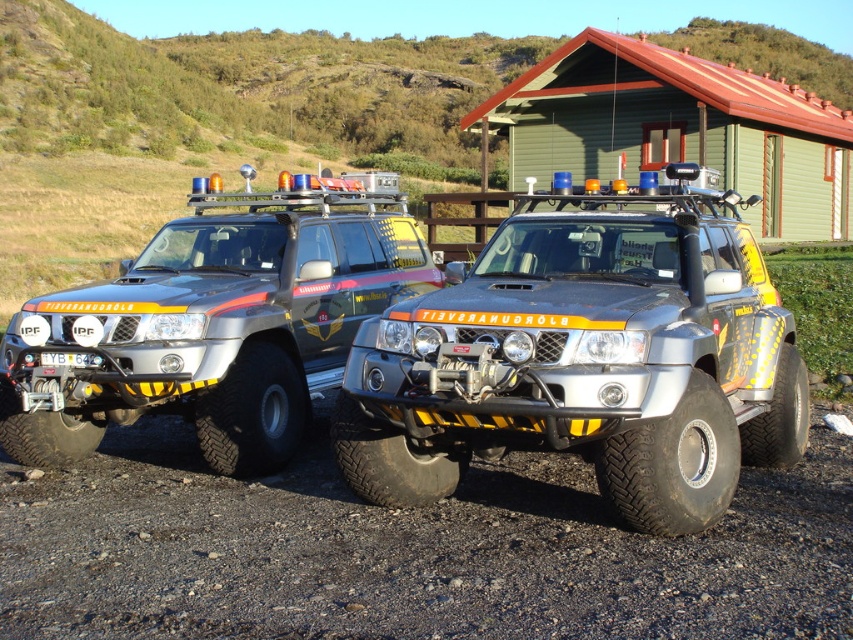
Who is more forward, (x=387, y=577) or (x=99, y=292)?

Point (x=387, y=577)

Who is shorter, dirt track at lower left or silver metallic suv at center?

With less height is dirt track at lower left.

Which is in front, point (488, 531) or point (189, 288)?

Point (488, 531) is in front.

Where is `dirt track at lower left`? Image resolution: width=853 pixels, height=640 pixels. dirt track at lower left is located at coordinates (409, 552).

What do you see at coordinates (409, 552) in the screenshot?
I see `dirt track at lower left` at bounding box center [409, 552].

Does dirt track at lower left appear on the right side of green wooden hut at upper center?

Incorrect, dirt track at lower left is not on the right side of green wooden hut at upper center.

Based on the photo, who is more distant from viewer, (35,564) or (772,156)?

The point (772,156) is more distant.

This screenshot has width=853, height=640. I want to click on dirt track at lower left, so click(x=409, y=552).

Which is above, matte black suv at center or silver metallic suv at center?

silver metallic suv at center is higher up.

Does point (711, 250) lie behind point (251, 413)?

No, it is not.

What do you see at coordinates (585, 358) in the screenshot?
I see `matte black suv at center` at bounding box center [585, 358].

The height and width of the screenshot is (640, 853). What are the coordinates of `matte black suv at center` in the screenshot? It's located at (585, 358).